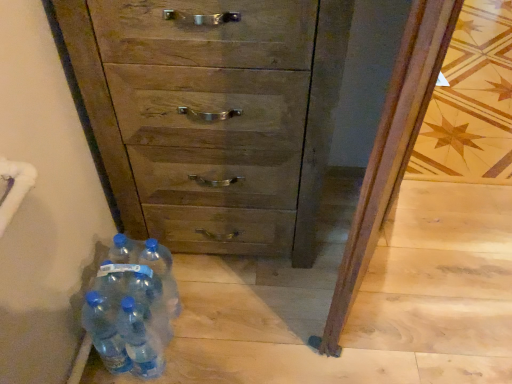
Question: Is blue translucent bottle at lower left, acting as the 1th bottle starting from the right, wider or thinner than transparent plastic bottles at lower left, the second bottle viewed from the right?

Choices:
 (A) wide
 (B) thin

Answer: (A)

Question: In the image, is blue translucent bottle at lower left, the fifth bottle positioned from the left, positioned in front of or behind transparent plastic bottles at lower left, the fourth bottle viewed from the left?

Choices:
 (A) behind
 (B) front

Answer: (A)

Question: Which is farther from the translucent plastic water bottles at lower left, the first bottle when ordered from left to right?

Choices:
 (A) blue plastic bottles at lower left, the 4th bottle in the right-to-left sequence
 (B) wooden chest of drawers at center
 (C) transparent plastic bottles at lower left, arranged as the third bottle when viewed from the left
 (D) blue translucent bottle at lower left, the fifth bottle positioned from the left
 (E) transparent plastic bottles at lower left, the fourth bottle viewed from the left

Answer: (B)

Question: Estimate the real-world distances between objects in this image. Which object is closer to the transparent plastic bottles at lower left, the fourth bottle viewed from the left?

Choices:
 (A) wooden chest of drawers at center
 (B) blue translucent bottle at lower left, acting as the 1th bottle starting from the right
 (C) transparent plastic bottles at lower left, acting as the 3th bottle starting from the right
 (D) blue plastic bottles at lower left, marked as the 2th bottle in a left-to-right arrangement
 (E) translucent plastic water bottles at lower left, acting as the fifth bottle starting from the right

Answer: (D)